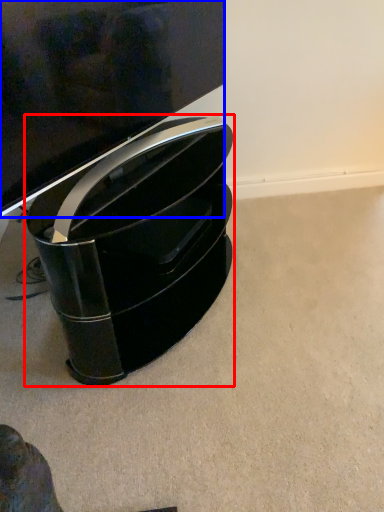
Question: Which of the following is the farthest to the observer, furniture (highlighted by a red box) or television (highlighted by a blue box)?

Choices:
 (A) furniture
 (B) television

Answer: (A)